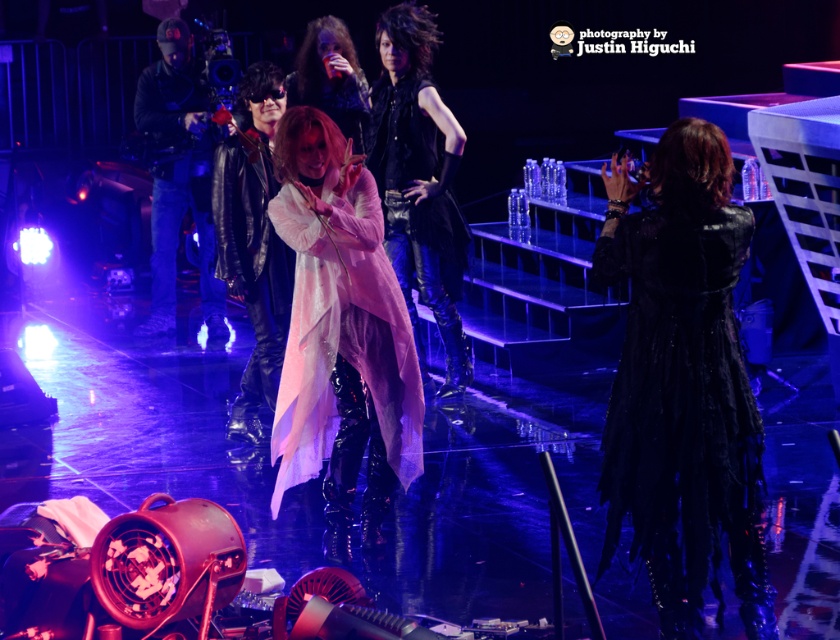
You are a stagehand who needs to place a 2.5 meters long ladder between the black leather coat at right and the pink matte coat at center. Can you fit the ladder horizontally between them?

The black leather coat at right is not as tall as the pink matte coat at center, but the height difference does not affect the horizontal space between them. The ladder is 2.5 meters long, but there is no information provided about the horizontal distance between the two coats. Therefore, it is impossible to determine if the ladder can fit horizontally between them based on the given information.

You are a stagehand trying to set up a new light on the stage. You need to place it between the two points, point (757, 458) and point (329, 417). Which point should the light be closer to to ensure it is in front of the other point?

The light should be closer to point (757, 458) because it is in front of point (329, 417).